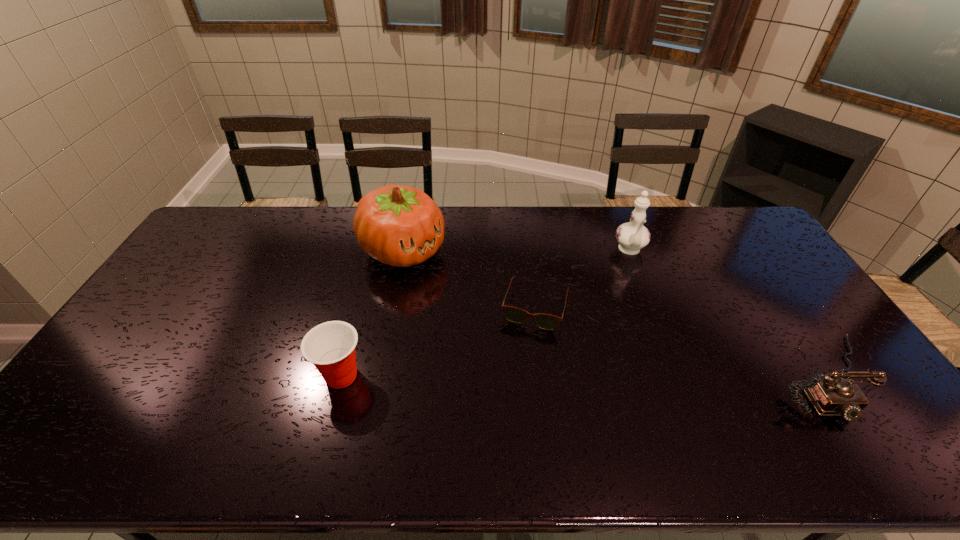
The width and height of the screenshot is (960, 540). Find the location of `free space on the desktop that is between the cup and the rightmost object and is positioned at the front view of the shortest object`. free space on the desktop that is between the cup and the rightmost object and is positioned at the front view of the shortest object is located at coordinates (516, 376).

Image resolution: width=960 pixels, height=540 pixels. In order to click on vacant spot on the desktop that is between the cup and the telephone and is positioned at the spout of the second object from right to left in this screenshot , I will do `click(653, 376)`.

Image resolution: width=960 pixels, height=540 pixels. I want to click on vacant space on the desktop that is between the cup and the telephone and is positioned on the side of the pumpkin with the cute face, so click(x=579, y=376).